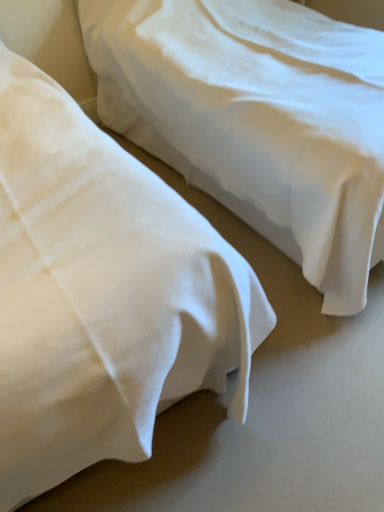
Question: In terms of width, does white smooth bed at center, positioned as the 2th bed in left-to-right order, look wider or thinner when compared to white cotton bed at center, acting as the first bed starting from the left?

Choices:
 (A) wide
 (B) thin

Answer: (B)

Question: From their relative heights in the image, would you say white smooth bed at center, positioned as the 2th bed in left-to-right order, is taller or shorter than white cotton bed at center, acting as the first bed starting from the left?

Choices:
 (A) tall
 (B) short

Answer: (B)

Question: Considering their positions, is white smooth bed at center, positioned as the 2th bed in left-to-right order, located in front of or behind white cotton bed at center, acting as the first bed starting from the left?

Choices:
 (A) behind
 (B) front

Answer: (A)

Question: Is white cotton bed at center, acting as the first bed starting from the left, wider or thinner than white smooth bed at center, positioned as the 2th bed in left-to-right order?

Choices:
 (A) thin
 (B) wide

Answer: (B)

Question: In the image, is white cotton bed at center, which is the second bed from right to left, on the left side or the right side of white smooth bed at center, positioned as the 2th bed in left-to-right order?

Choices:
 (A) left
 (B) right

Answer: (A)

Question: Considering their positions, is white cotton bed at center, which is the second bed from right to left, located in front of or behind white smooth bed at center, positioned as the 1th bed in right-to-left order?

Choices:
 (A) front
 (B) behind

Answer: (A)

Question: From the image's perspective, is white cotton bed at center, acting as the first bed starting from the left, positioned above or below white smooth bed at center, positioned as the 2th bed in left-to-right order?

Choices:
 (A) above
 (B) below

Answer: (B)